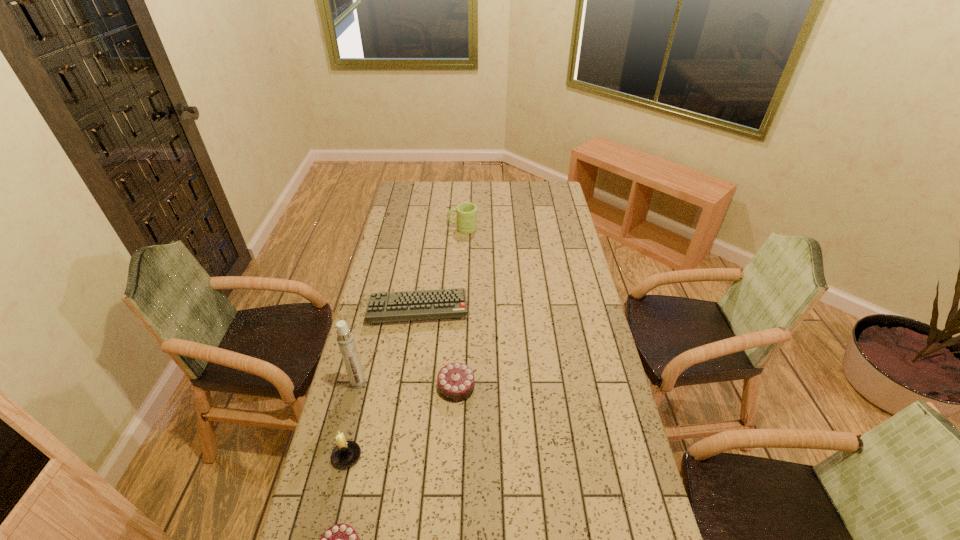
Identify the location of free spot located on the right of the aerosol can. (397, 383).

At what (x,y) coordinates should I click in order to perform the action: click on free space located on the back of the fifth nearest object. Please return your answer as a coordinate pair (x, y). Looking at the image, I should click on (422, 277).

Locate an element on the screen. The width and height of the screenshot is (960, 540). free region located on the right of the candle holder is located at coordinates (471, 456).

The image size is (960, 540). What are the coordinates of `aerosol can that is at the left edge` in the screenshot? It's located at (345, 339).

You are a GUI agent. You are given a task and a screenshot of the screen. Output one action in this format:
    pyautogui.click(x=<x>, y=<y>)
    Task: Click on the computer keyboard that is at the left edge
    
    Given the screenshot: What is the action you would take?
    pyautogui.click(x=441, y=303)

You are a GUI agent. You are given a task and a screenshot of the screen. Output one action in this format:
    pyautogui.click(x=<x>, y=<y>)
    Task: Click on the candle holder present at the left edge
    Image resolution: width=960 pixels, height=540 pixels.
    Given the screenshot: What is the action you would take?
    pyautogui.click(x=346, y=453)

Find the location of `vacant space at the far edge of the desktop`. vacant space at the far edge of the desktop is located at coordinates (427, 202).

Locate an element on the screen. The image size is (960, 540). free space at the left edge of the desktop is located at coordinates (348, 477).

In the image, there is a desktop. Identify the location of vacant space at the right edge. This screenshot has width=960, height=540. (542, 205).

Identify the location of vacant space at the far left corner. This screenshot has height=540, width=960. (421, 195).